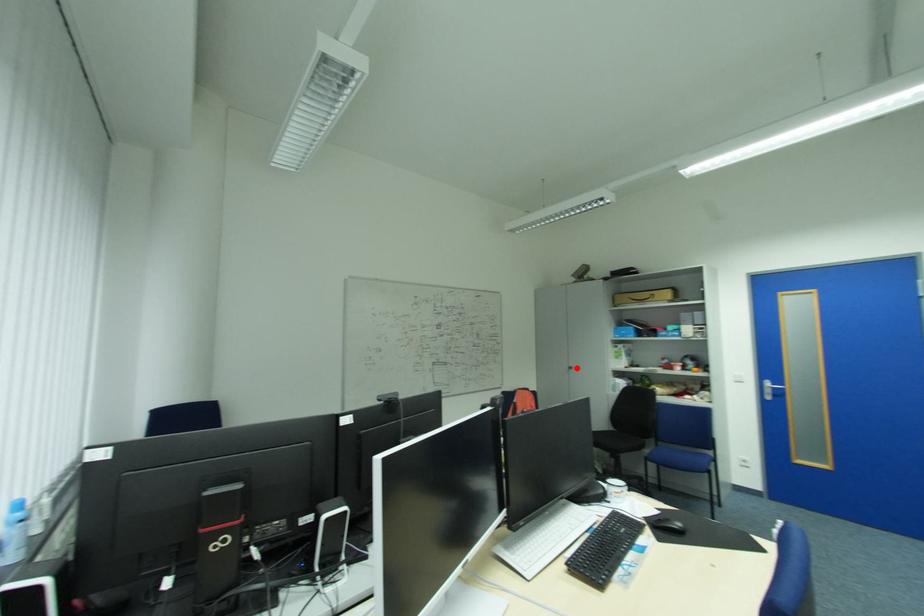
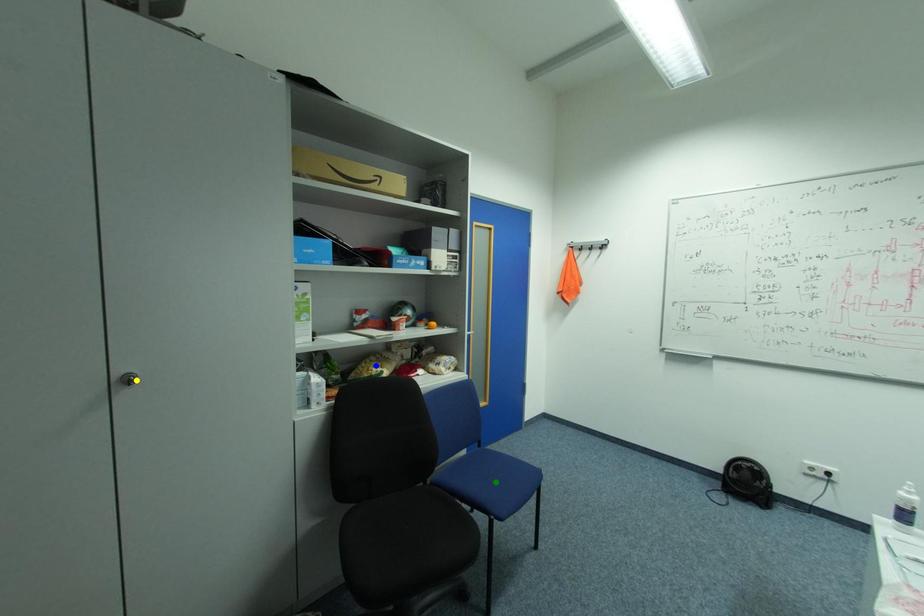
Question: I am providing you with two images of the same scene from different viewpoints. A red point is marked on the first image. You are given multiple points on the second image. In image 2, which mark is for the same physical point as the one in image 1?

Choices:
 (A) yellow point
 (B) blue point
 (C) green point

Answer: (A)